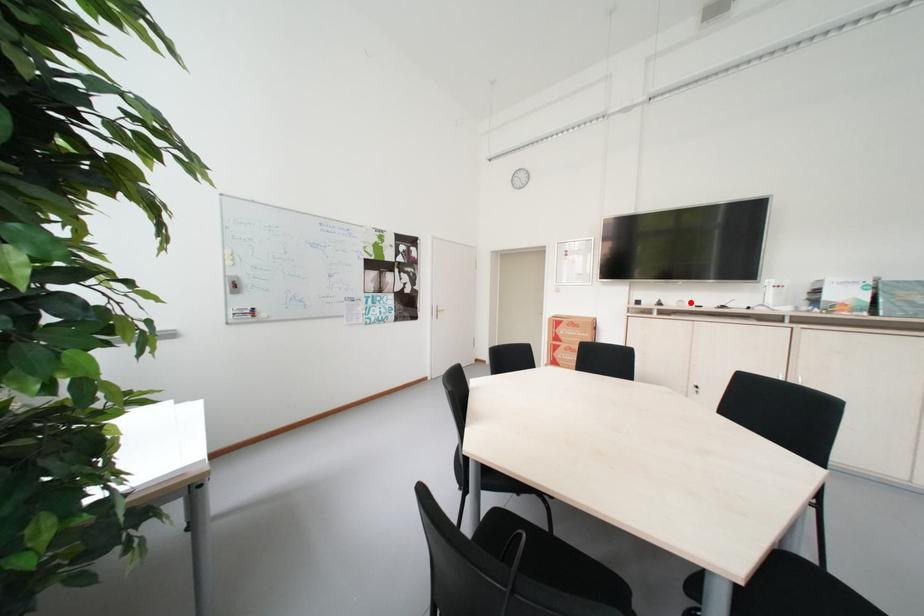
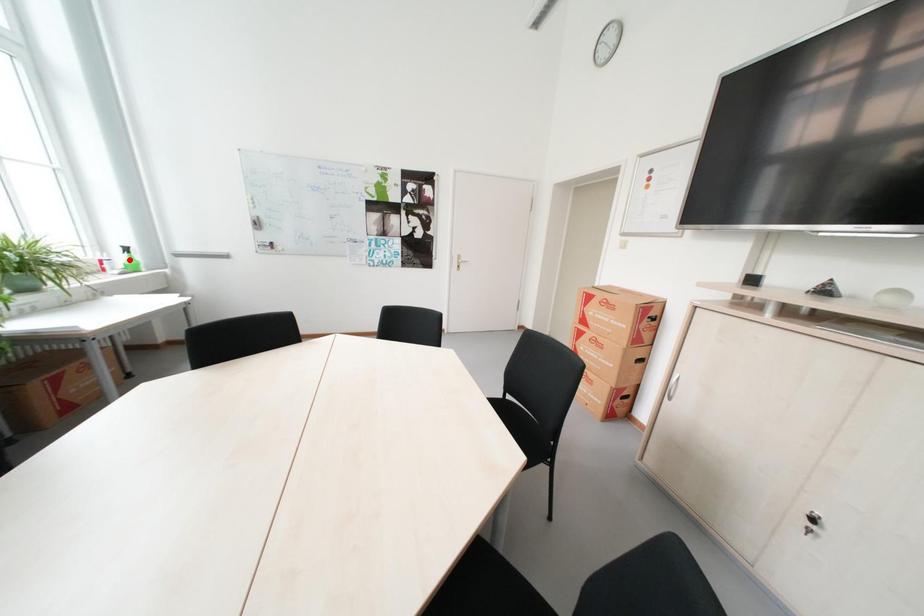
I am providing you with two images of the same scene from different viewpoints. A red point is marked on the first image and another point is marked on the second image. Is the marked point in image1 the same physical position as the marked point in image2?

No